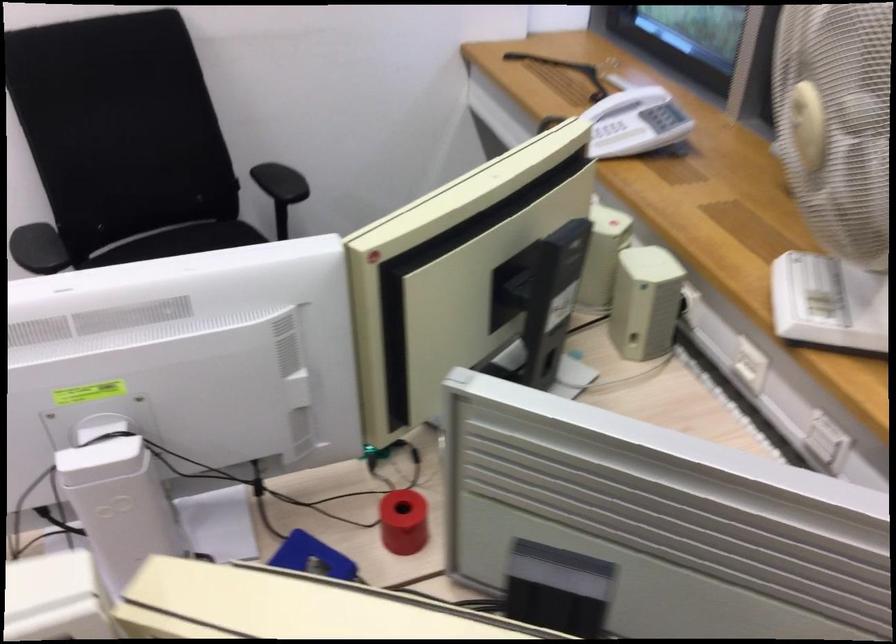
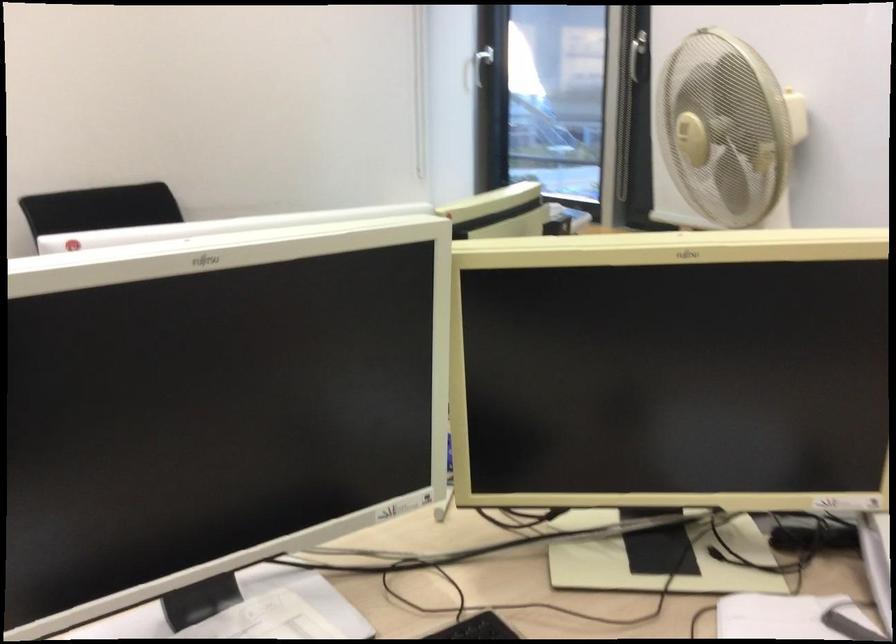
Question: I am providing you with two images of the same scene from different viewpoints. After the viewpoint changes to image2, which objects are now occluded?

Choices:
 (A) scanner lid
 (B) telephone keypad
 (C) black massage gun
 (D) fan control knob

Answer: (B)